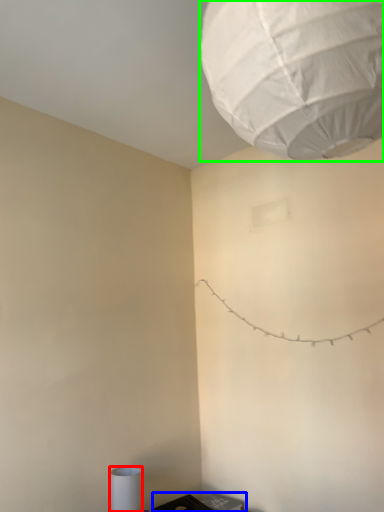
Question: Estimate the real-world distances between objects in this image. Which object is farther from lamp (highlighted by a red box), furniture (highlighted by a blue box) or lantern (highlighted by a green box)?

Choices:
 (A) furniture
 (B) lantern

Answer: (B)